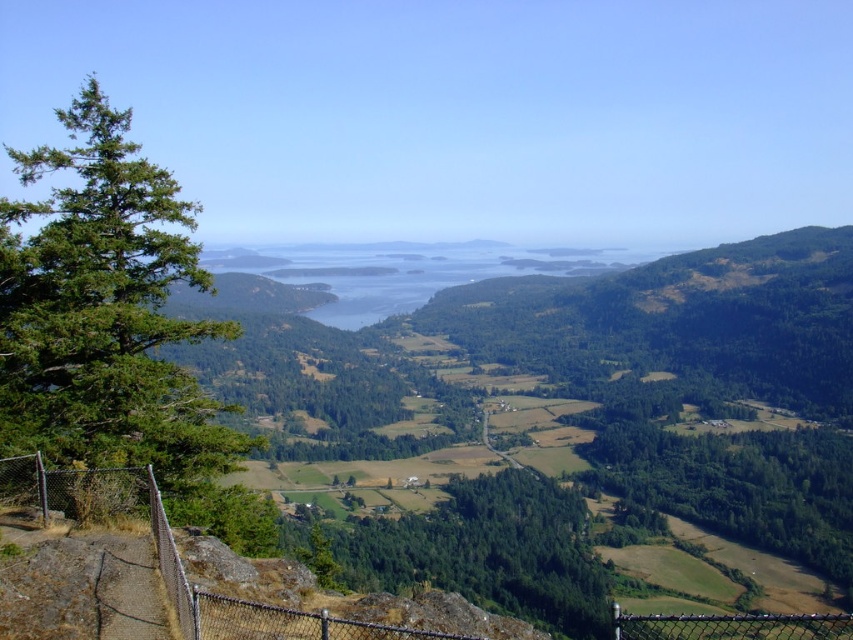
Who is positioned more to the left, rusty chain-link fence at lower center or chain link fence at lower right?

From the viewer's perspective, rusty chain-link fence at lower center appears more on the left side.

You are a GUI agent. You are given a task and a screenshot of the screen. Output one action in this format:
    pyautogui.click(x=<x>, y=<y>)
    Task: Click on the rusty chain-link fence at lower center
    Image resolution: width=853 pixels, height=640 pixels.
    Given the screenshot: What is the action you would take?
    pyautogui.click(x=175, y=556)